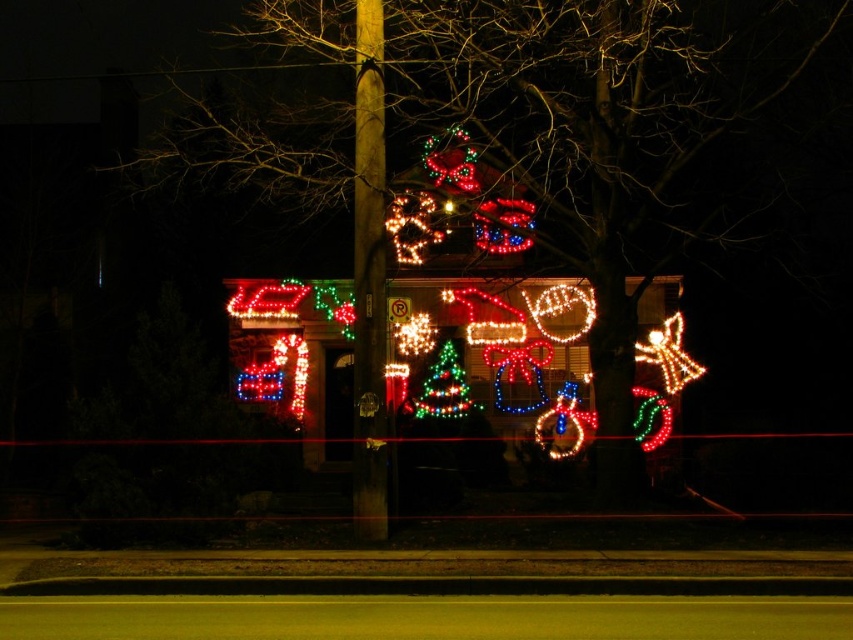
Question: Is illuminated lights at center above green matte christmas tree at center?

Choices:
 (A) yes
 (B) no

Answer: (A)

Question: Which point is farther from the camera taking this photo?

Choices:
 (A) (434, 22)
 (B) (367, 61)
 (C) (433, 365)

Answer: (C)

Question: Is the position of smooth wooden pole at center more distant than that of green matte christmas tree at center?

Choices:
 (A) no
 (B) yes

Answer: (A)

Question: Does illuminated lights at center have a greater width compared to smooth wooden pole at center?

Choices:
 (A) no
 (B) yes

Answer: (B)

Question: Which object is the closest to the illuminated lights at center?

Choices:
 (A) green matte christmas tree at center
 (B) smooth wooden pole at center

Answer: (A)

Question: Which object is the closest to the illuminated lights at center?

Choices:
 (A) green matte christmas tree at center
 (B) smooth wooden pole at center

Answer: (A)